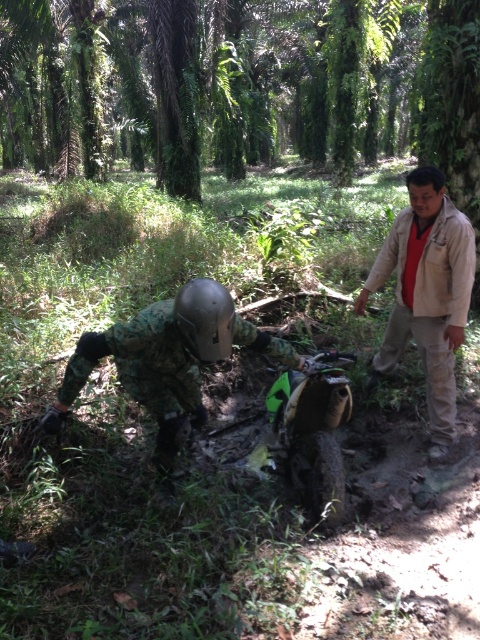
Can you confirm if green camouflage uniform at center is smaller than metallic gray helmet at center?

No.

Is green camouflage uniform at center taller than metallic gray helmet at center?

Correct, green camouflage uniform at center is much taller as metallic gray helmet at center.

The height and width of the screenshot is (640, 480). What do you see at coordinates (168, 358) in the screenshot?
I see `green camouflage uniform at center` at bounding box center [168, 358].

Locate an element on the screen. green camouflage uniform at center is located at coordinates (168, 358).

Which is below, beige cotton shirt at upper right or metallic gray helmet at center?

metallic gray helmet at center is lower down.

You are a GUI agent. You are given a task and a screenshot of the screen. Output one action in this format:
    pyautogui.click(x=<x>, y=<y>)
    Task: Click on the beige cotton shirt at upper right
    
    Given the screenshot: What is the action you would take?
    pyautogui.click(x=427, y=292)

Does point (453, 388) lie behind point (203, 355)?

That is True.

You are a GUI agent. You are given a task and a screenshot of the screen. Output one action in this format:
    pyautogui.click(x=<x>, y=<y>)
    Task: Click on the beige cotton shirt at upper right
    The width and height of the screenshot is (480, 640).
    Given the screenshot: What is the action you would take?
    pyautogui.click(x=427, y=292)

Between green camouflage uniform at center and beige cotton shirt at upper right, which one is positioned lower?

green camouflage uniform at center

Is green camouflage uniform at center closer to the viewer compared to beige cotton shirt at upper right?

Yes, green camouflage uniform at center is in front of beige cotton shirt at upper right.

Measure the distance between point (48, 420) and camera.

The distance of point (48, 420) from camera is 2.83 meters.

What are the coordinates of `green camouflage uniform at center` in the screenshot? It's located at (168, 358).